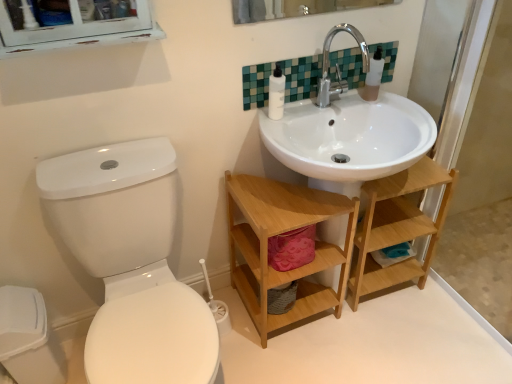
I want to click on vacant region to the left of transparent plastic soap dispenser at upper right, so click(x=341, y=98).